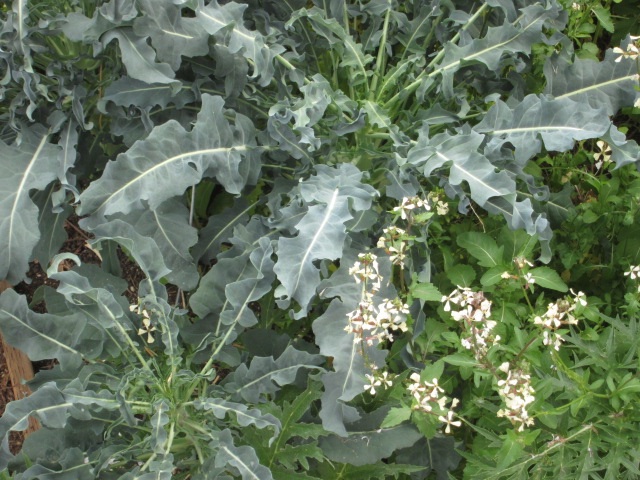
Locate an element on the screen. The width and height of the screenshot is (640, 480). green plants is located at coordinates (586, 399), (601, 165), (499, 252).